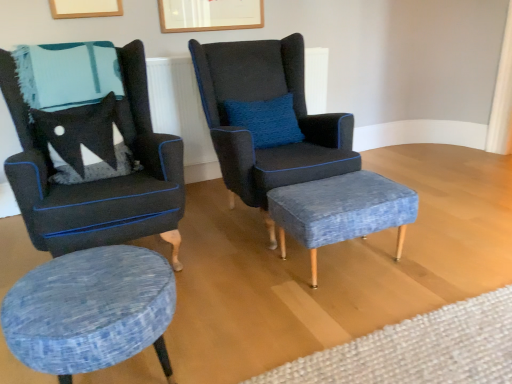
I want to click on vacant space in front of blue fabric stool at center, which appears as the 1th stool when viewed from the right, so click(x=342, y=313).